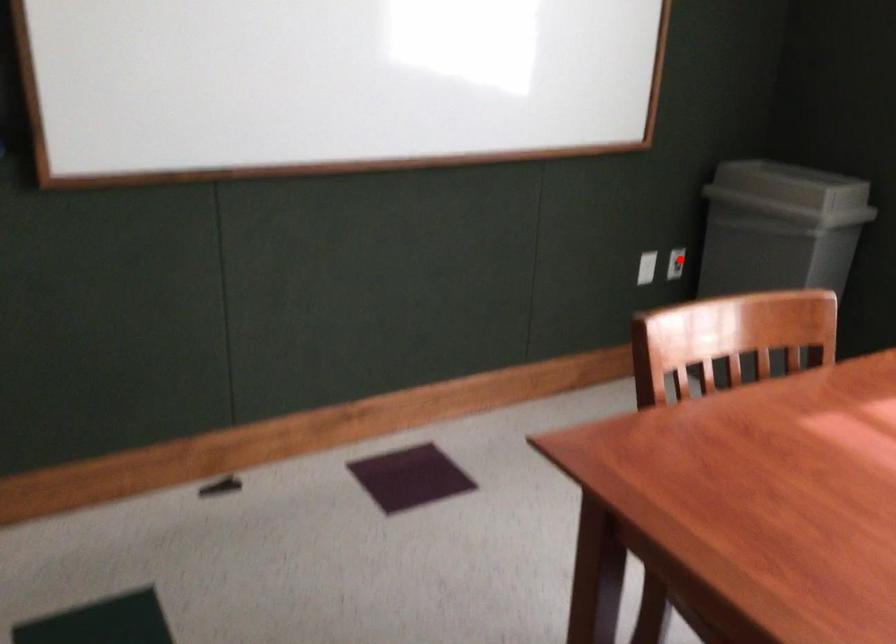
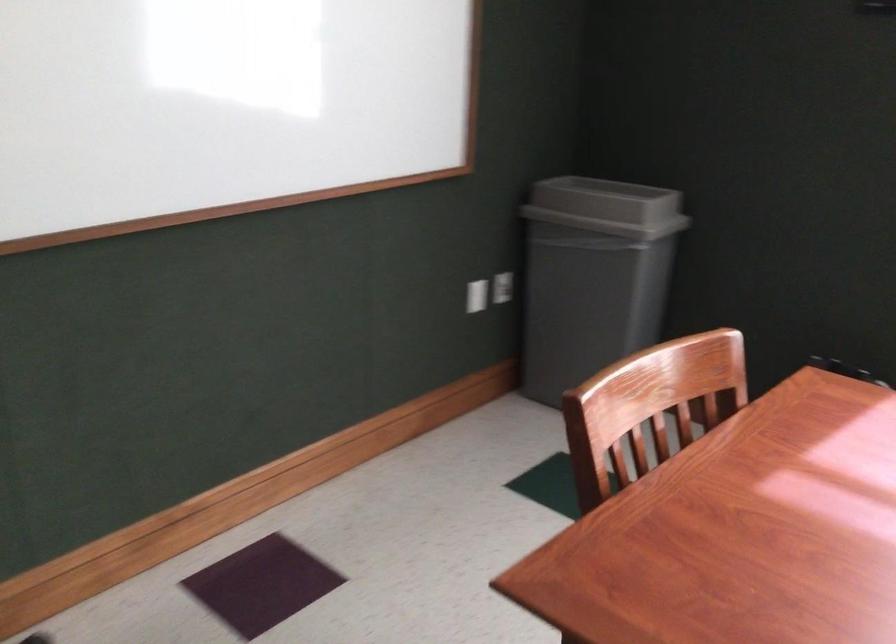
In the second image, find the point that corresponds to the highlighted location in the first image.

(503, 287)